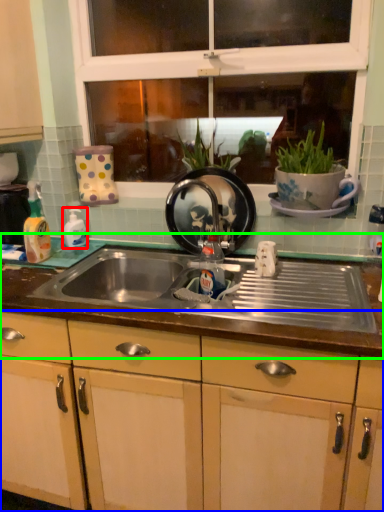
Question: Based on their relative distances, which object is nearer to bottle (highlighted by a red box)? Choose from cabinetry (highlighted by a blue box) and countertop (highlighted by a green box).

Choices:
 (A) cabinetry
 (B) countertop

Answer: (B)